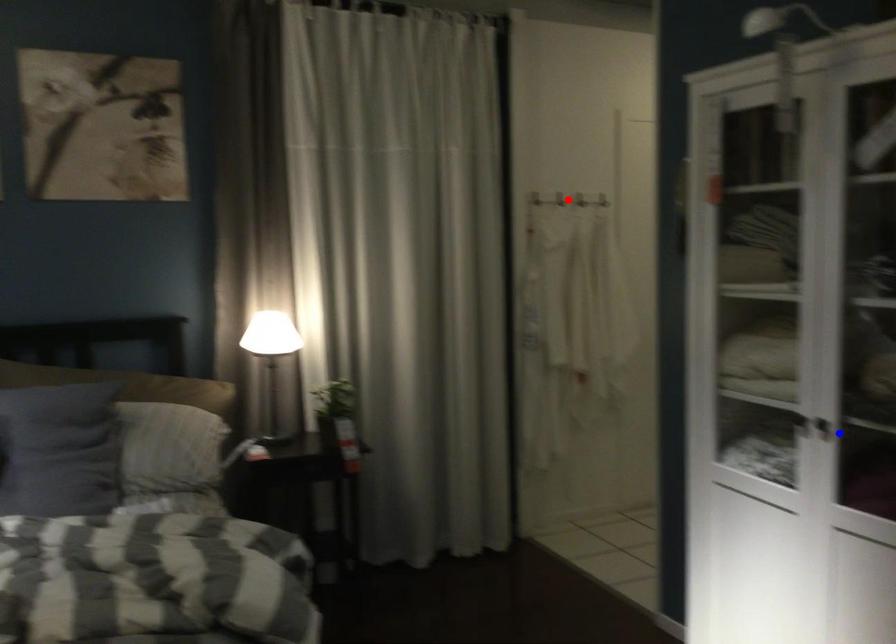
Question: In the image, two points are highlighted. Which point is nearer to the camera? Reply with the corresponding letter.

Choices:
 (A) blue point
 (B) red point

Answer: (A)